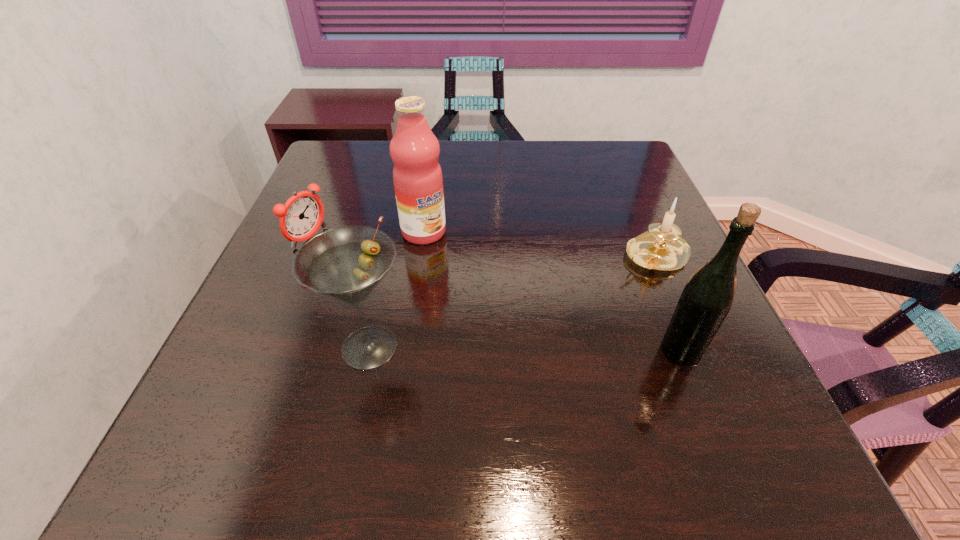
Where is `free space on the desktop that is between the martini and the beer bottle and is positioned on the label of the fruit juice`? This screenshot has height=540, width=960. free space on the desktop that is between the martini and the beer bottle and is positioned on the label of the fruit juice is located at coordinates (534, 349).

The height and width of the screenshot is (540, 960). Identify the location of free spot on the desktop that is between the martini and the beer bottle and is positioned on the front-facing side of the alarm clock. (540, 349).

Where is `free space on the desktop that is between the martini and the beer bottle and is positioned on the handle side of the second shortest object`? The height and width of the screenshot is (540, 960). free space on the desktop that is between the martini and the beer bottle and is positioned on the handle side of the second shortest object is located at coordinates (482, 348).